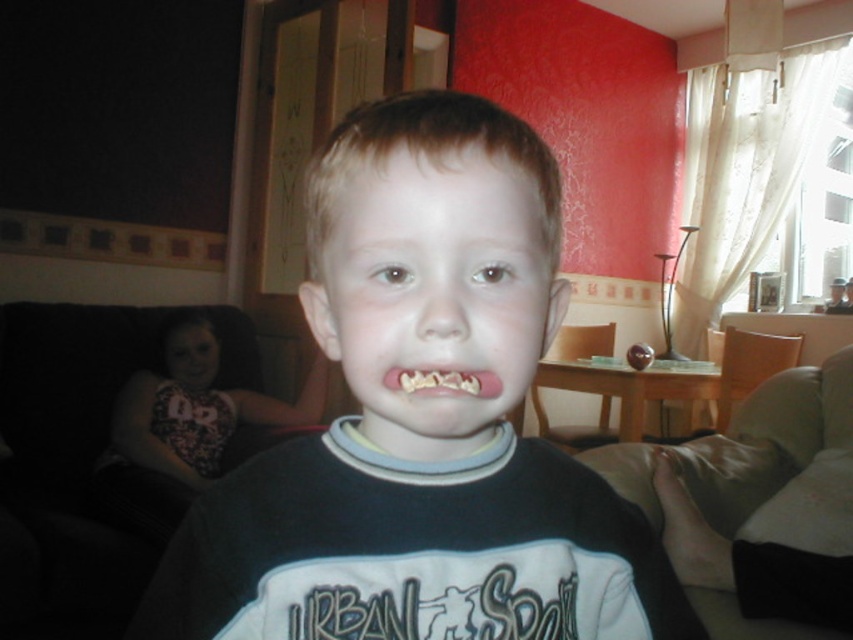
You are a parent trying to clean up the living room. You have a toy box that is 1.5 meters wide. You see the dark pink fabric at left and the pink rubber mouth at center. Can you fit both items into the toy box if you place them side by side?

The distance between dark pink fabric at left and pink rubber mouth at center is 1.88 meters, which is greater than the toy box width of 1.5 meters. Therefore, they cannot be placed side by side in the toy box.

You are a photographer setting up for a family photo. You notice the black cotton shirt at center and the pink rubber mouth at center in the scene. Which object should you focus on to ensure it appears clearer in the photo if you can only choose one due to limited depth of field?

The black cotton shirt at center is larger in size than the pink rubber mouth at center, so focusing on the black cotton shirt at center would ensure it appears clearer since larger objects generally require less precise focus to remain sharp within a limited depth of field.